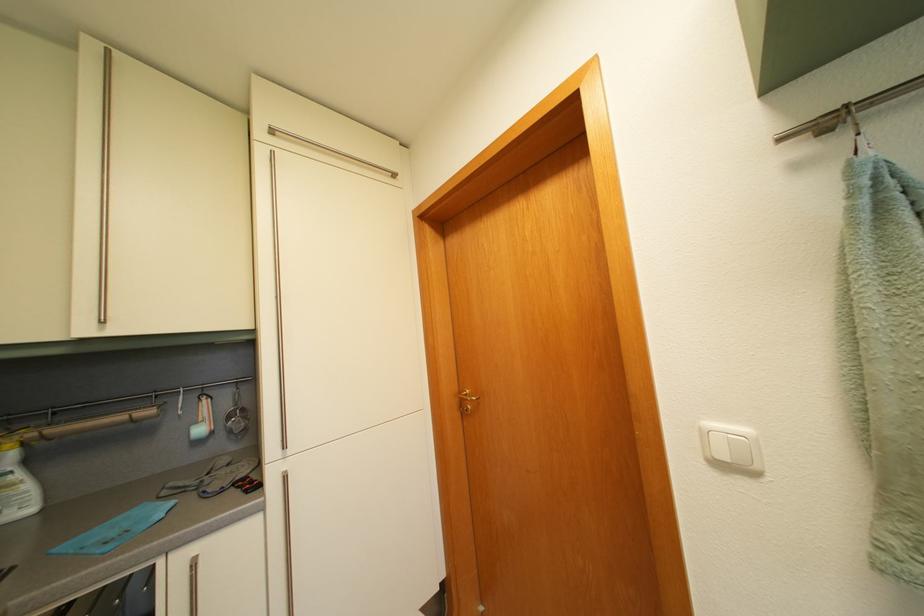
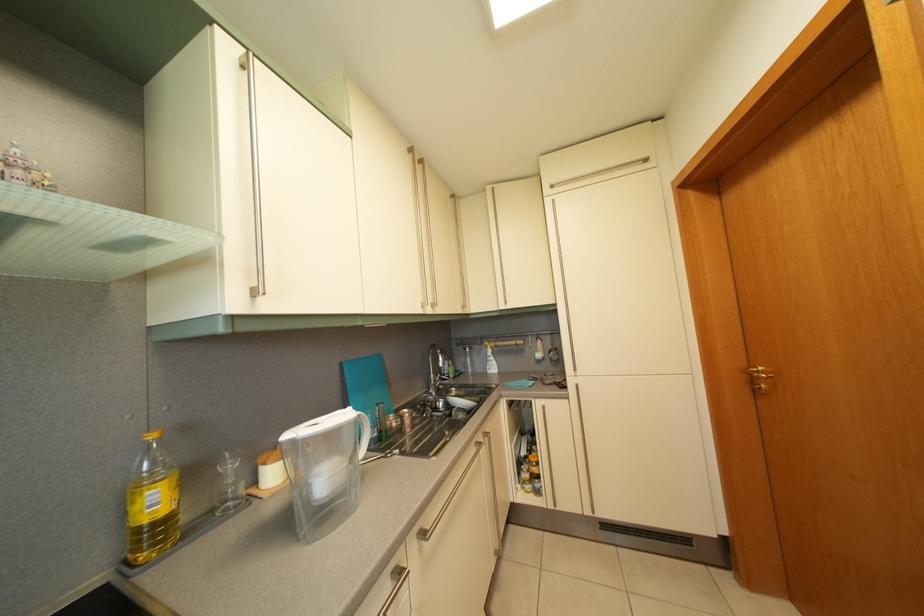
Question: The camera is either moving clockwise (left) or counter-clockwise (right) around the object. The first image is from the beginning of the video and the second image is from the end. Is the camera moving left or right when shooting the video?

Choices:
 (A) Left
 (B) Right

Answer: (B)